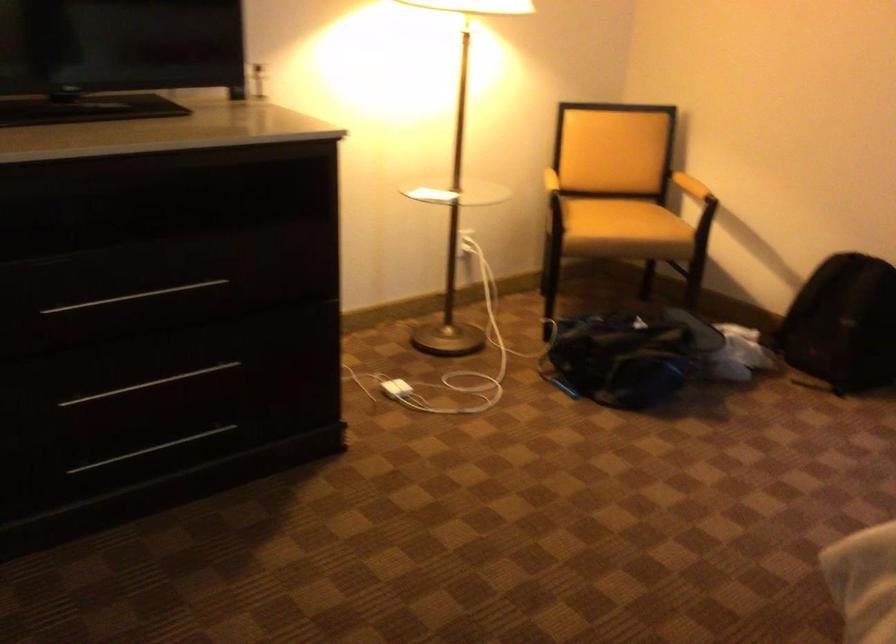
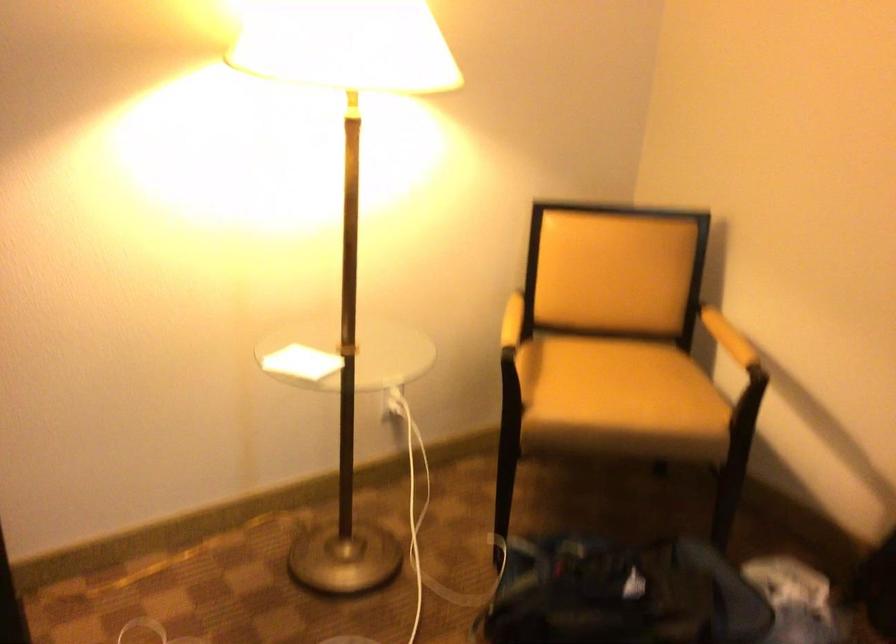
Locate, in the second image, the point that corresponds to (423,196) in the first image.

(300, 363)